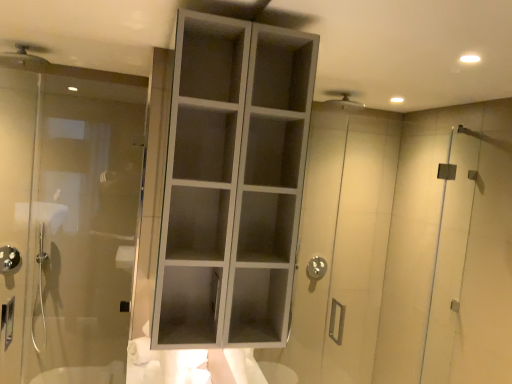
Question: Looking at their shapes, would you say transparent glass door at left is wider or thinner than matte silver shower head at upper left, which appears as the 1th shower when viewed from the right?

Choices:
 (A) wide
 (B) thin

Answer: (B)

Question: From the image's perspective, relative to matte silver shower head at upper left, the 1th shower from the front, is transparent glass door at left above or below?

Choices:
 (A) below
 (B) above

Answer: (A)

Question: Which of these objects is positioned closest to the brushed metal showerhead at lower left, which appears as the 2th shower when viewed from the top?

Choices:
 (A) matte silver shower head at upper left, the first shower when ordered from top to bottom
 (B) transparent glass door at left
 (C) white matte cabinet at center

Answer: (B)

Question: Estimate the real-world distances between objects in this image. Which object is closer to the white matte cabinet at center?

Choices:
 (A) brushed metal showerhead at lower left, arranged as the 2th shower when viewed from the front
 (B) transparent glass door at left
 (C) matte silver shower head at upper left, the first shower when ordered from top to bottom

Answer: (B)